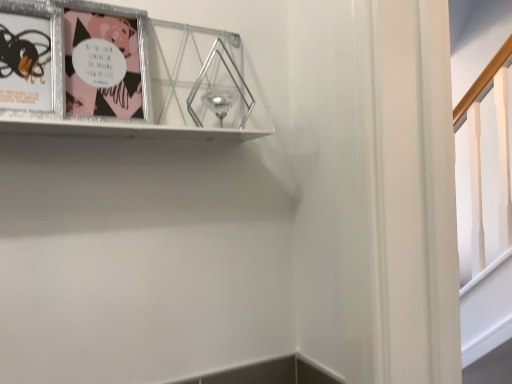
Question: Is the depth of metallic silver picture frame at upper left, placed as the 3th picture frame when sorted from right to left, greater than that of metallic silver picture frame at upper left, the 2th picture frame positioned from the right?

Choices:
 (A) yes
 (B) no

Answer: (B)

Question: Is metallic silver picture frame at upper left, the 1th picture frame viewed from the left, to the left of metallic silver picture frame at upper left, the 2th picture frame positioned from the right, from the viewer's perspective?

Choices:
 (A) no
 (B) yes

Answer: (B)

Question: Can you confirm if metallic silver picture frame at upper left, the 1th picture frame viewed from the left, is smaller than metallic silver picture frame at upper left, the 2th picture frame positioned from the right?

Choices:
 (A) yes
 (B) no

Answer: (A)

Question: From the image's perspective, does metallic silver picture frame at upper left, the 1th picture frame viewed from the left, appear lower than metallic silver picture frame at upper left, the 2th picture frame positioned from the right?

Choices:
 (A) no
 (B) yes

Answer: (B)

Question: Is metallic silver picture frame at upper left, the 1th picture frame viewed from the left, shorter than metallic silver picture frame at upper left, the 2th picture frame positioned from the right?

Choices:
 (A) yes
 (B) no

Answer: (A)

Question: Is metallic silver picture frame at upper left, the 1th picture frame viewed from the left, turned away from metallic silver picture frame at upper left, the 2th picture frame positioned from the right?

Choices:
 (A) yes
 (B) no

Answer: (B)

Question: Can you confirm if metallic silver picture frame at upper left, the third picture frame from the left, is bigger than metallic silver picture frame at upper left, the second picture frame when ordered from left to right?

Choices:
 (A) yes
 (B) no

Answer: (A)

Question: Is metallic silver picture frame at upper left, the third picture frame from the left, to the left of metallic silver picture frame at upper left, the second picture frame when ordered from left to right, from the viewer's perspective?

Choices:
 (A) no
 (B) yes

Answer: (A)

Question: Is metallic silver picture frame at upper left, acting as the first picture frame starting from the right, to the right of metallic silver picture frame at upper left, the 2th picture frame positioned from the right, from the viewer's perspective?

Choices:
 (A) yes
 (B) no

Answer: (A)

Question: Is metallic silver picture frame at upper left, acting as the first picture frame starting from the right, far away from metallic silver picture frame at upper left, the second picture frame when ordered from left to right?

Choices:
 (A) yes
 (B) no

Answer: (B)

Question: Is metallic silver picture frame at upper left, the third picture frame from the left, positioned beyond the bounds of metallic silver picture frame at upper left, the 2th picture frame positioned from the right?

Choices:
 (A) yes
 (B) no

Answer: (A)

Question: Does metallic silver picture frame at upper left, acting as the first picture frame starting from the right, lie behind metallic silver picture frame at upper left, the 2th picture frame positioned from the right?

Choices:
 (A) no
 (B) yes

Answer: (A)

Question: Is metallic silver picture frame at upper left, the 1th picture frame viewed from the left, located outside metallic silver picture frame at upper left, the third picture frame from the left?

Choices:
 (A) no
 (B) yes

Answer: (A)